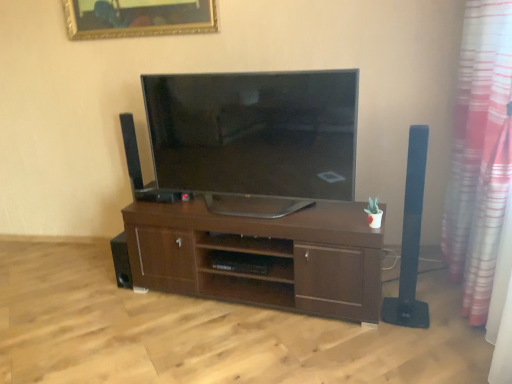
Question: Can you confirm if pink striped curtain at right is positioned to the right of brown wood shelf at center?

Choices:
 (A) yes
 (B) no

Answer: (A)

Question: Is pink striped curtain at right oriented towards brown wood shelf at center?

Choices:
 (A) no
 (B) yes

Answer: (B)

Question: Is pink striped curtain at right closer to camera compared to brown wood shelf at center?

Choices:
 (A) yes
 (B) no

Answer: (A)

Question: Is pink striped curtain at right further to the viewer compared to brown wood shelf at center?

Choices:
 (A) no
 (B) yes

Answer: (A)

Question: Is pink striped curtain at right taller than brown wood shelf at center?

Choices:
 (A) no
 (B) yes

Answer: (B)

Question: Does pink striped curtain at right appear on the left side of brown wood shelf at center?

Choices:
 (A) no
 (B) yes

Answer: (A)

Question: Are gold-framed mirror at upper center and black matte speaker at left, marked as the 2th speaker in a left-to-right arrangement, located far from each other?

Choices:
 (A) no
 (B) yes

Answer: (A)

Question: Does gold-framed mirror at upper center have a greater height compared to black matte speaker at left, positioned as the 3th speaker in front-to-back order?

Choices:
 (A) no
 (B) yes

Answer: (A)

Question: Considering the relative sizes of gold-framed mirror at upper center and black matte speaker at left, which is the first speaker in back-to-front order, in the image provided, is gold-framed mirror at upper center bigger than black matte speaker at left, which is the first speaker in back-to-front order,?

Choices:
 (A) yes
 (B) no

Answer: (B)

Question: Is gold-framed mirror at upper center further to the viewer compared to black matte speaker at left, positioned as the 3th speaker in front-to-back order?

Choices:
 (A) no
 (B) yes

Answer: (A)

Question: Is gold-framed mirror at upper center at the left side of black matte speaker at left, which is the first speaker in back-to-front order?

Choices:
 (A) no
 (B) yes

Answer: (A)

Question: From a real-world perspective, is gold-framed mirror at upper center under black matte speaker at left, which is the first speaker in back-to-front order?

Choices:
 (A) yes
 (B) no

Answer: (B)

Question: Can you confirm if gold-framed mirror at upper center is taller than pink striped curtain at right?

Choices:
 (A) no
 (B) yes

Answer: (A)